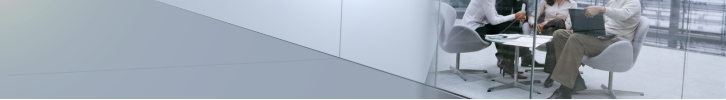
This screenshot has height=100, width=726. In order to click on table leg in this screenshot , I will do `click(515, 60)`.